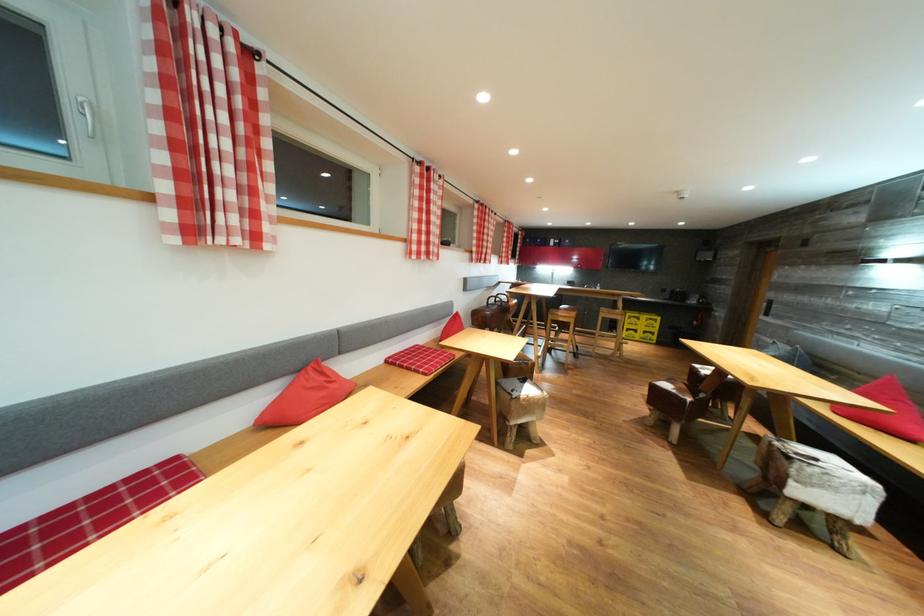
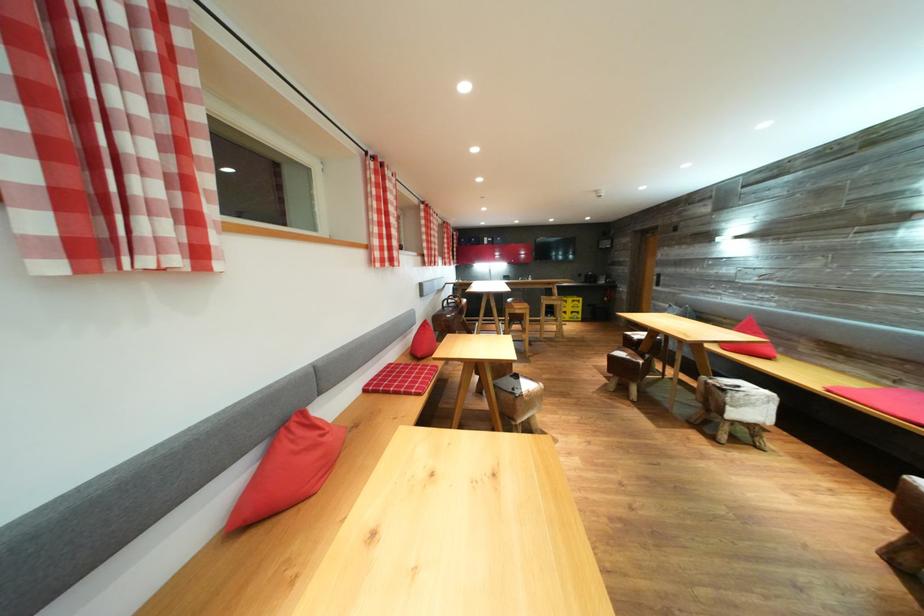
In the second image, find the point that corresponds to (696,405) in the first image.

(648, 367)